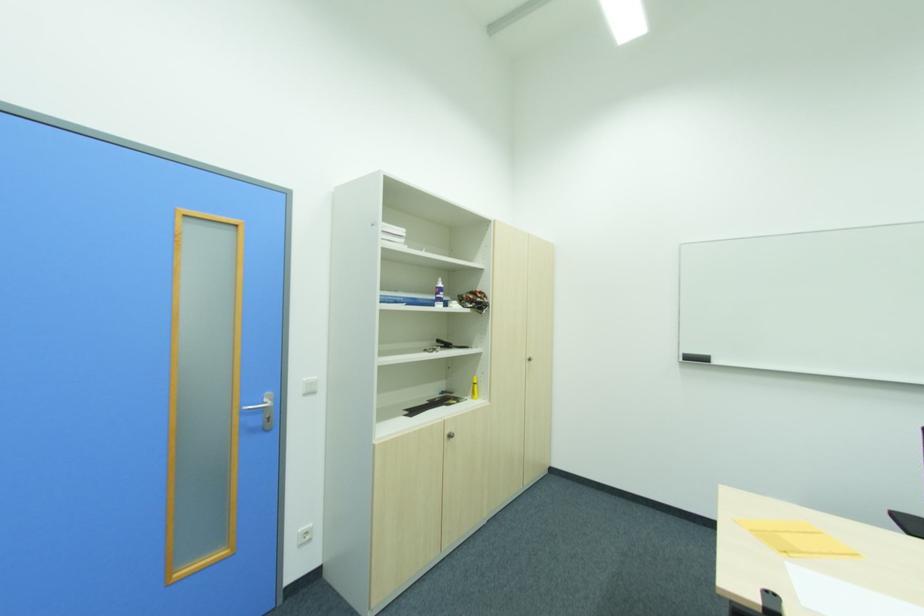
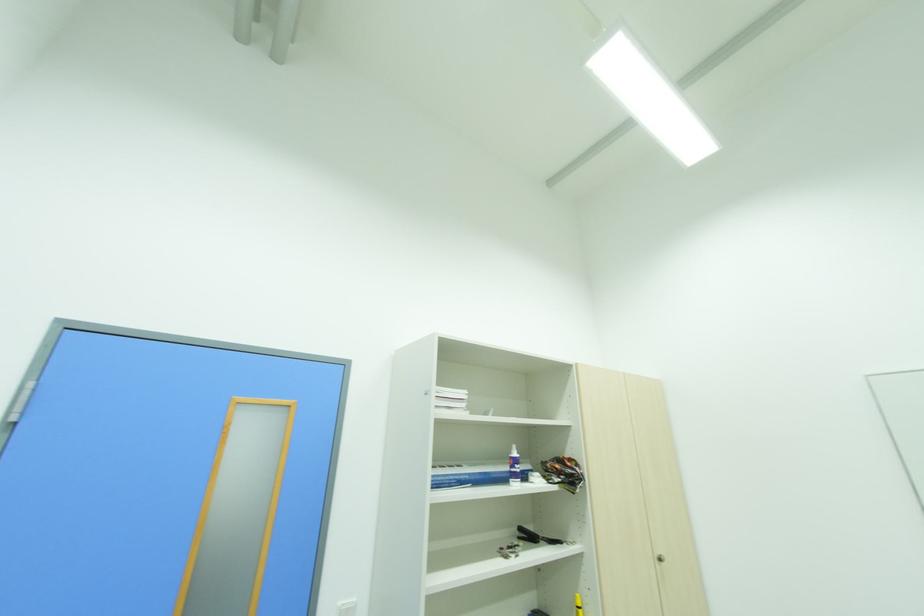
Locate, in the second image, the point that corresponds to point (532, 360) in the first image.

(663, 561)